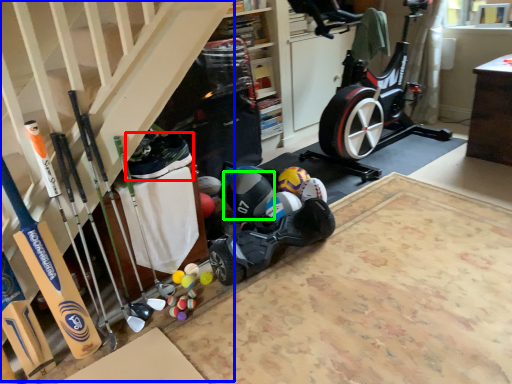
Question: Estimate the real-world distances between objects in this image. Which object is closer to shoe (highlighted by a red box), stairs (highlighted by a blue box) or sports equipment (highlighted by a green box)?

Choices:
 (A) stairs
 (B) sports equipment

Answer: (A)